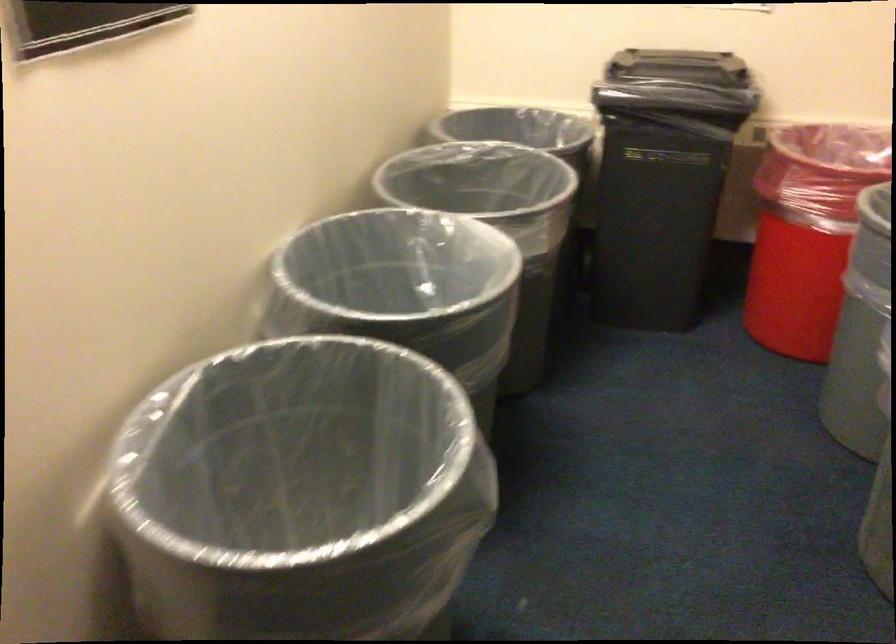
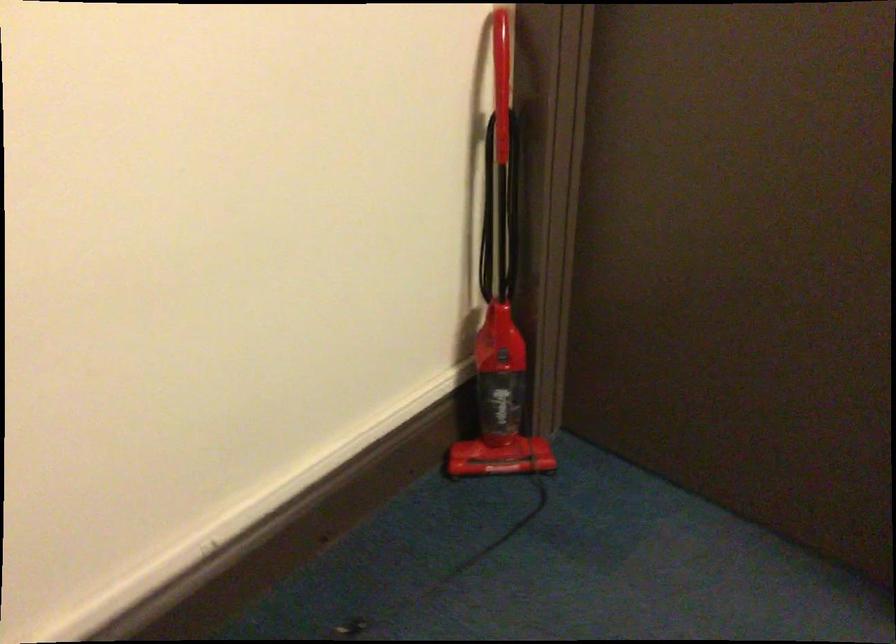
How did the camera likely rotate?

The rotation direction of the camera is left-down.